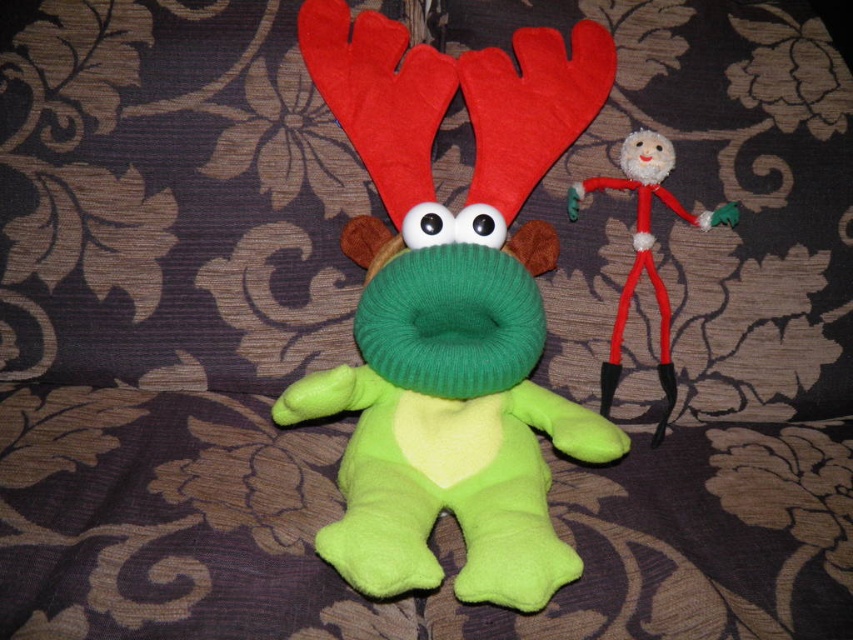
Question: Which of the following is the closest to the observer?

Choices:
 (A) fuzzy red stick figure at upper right
 (B) green soft plush toy at center

Answer: (B)

Question: Which point is closer to the camera?

Choices:
 (A) (430, 529)
 (B) (650, 172)

Answer: (A)

Question: Is green soft plush toy at center positioned behind fuzzy red stick figure at upper right?

Choices:
 (A) no
 (B) yes

Answer: (A)

Question: Is green soft plush toy at center positioned at the back of fuzzy red stick figure at upper right?

Choices:
 (A) no
 (B) yes

Answer: (A)

Question: Does green soft plush toy at center have a smaller size compared to fuzzy red stick figure at upper right?

Choices:
 (A) yes
 (B) no

Answer: (B)

Question: Which of the following is the closest to the observer?

Choices:
 (A) green soft plush toy at center
 (B) fuzzy red stick figure at upper right

Answer: (A)